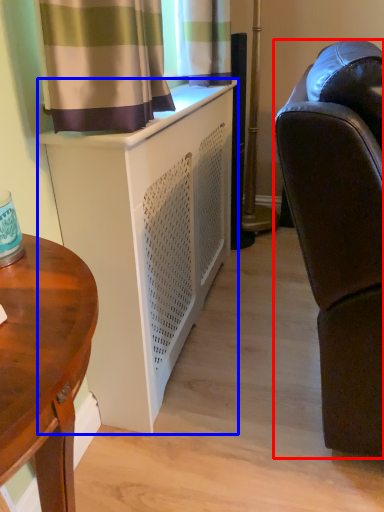
Question: Which object is closer to the camera taking this photo, studio couch (highlighted by a red box) or cabinetry (highlighted by a blue box)?

Choices:
 (A) studio couch
 (B) cabinetry

Answer: (A)